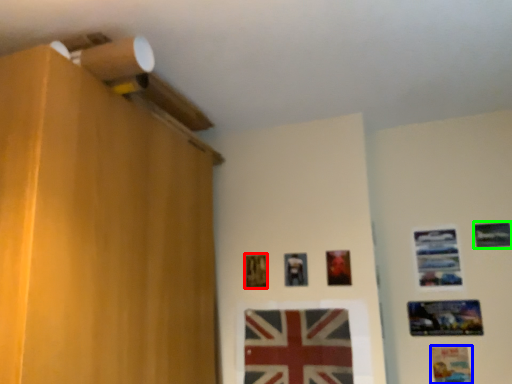
Question: Estimate the real-world distances between objects in this image. Which object is closer to picture frame (highlighted by a red box), picture frame (highlighted by a blue box) or picture frame (highlighted by a green box)?

Choices:
 (A) picture frame
 (B) picture frame

Answer: (A)